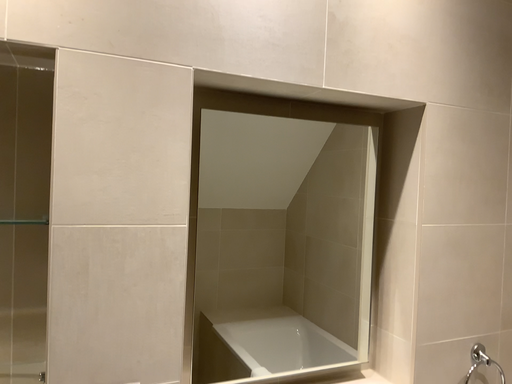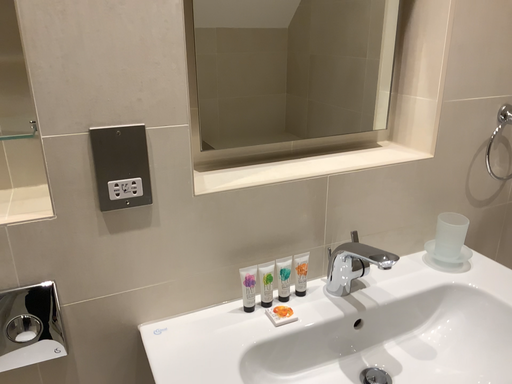
Question: How did the camera likely rotate when shooting the video?

Choices:
 (A) rotated downward
 (B) rotated upward

Answer: (A)